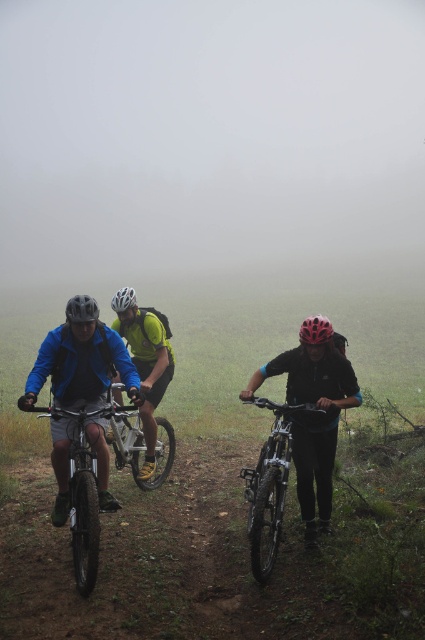
You are a drone operator trying to capture a photo of the three mountain bikers. The drone is currently hovering at the foggy mist at center. Which direction should you move the drone to get a clearer shot of the bikers?

The foggy mist at center is located at point (207, 134). To get a clearer shot of the bikers, you should move the drone away from the foggy mist at center towards areas with less fog.